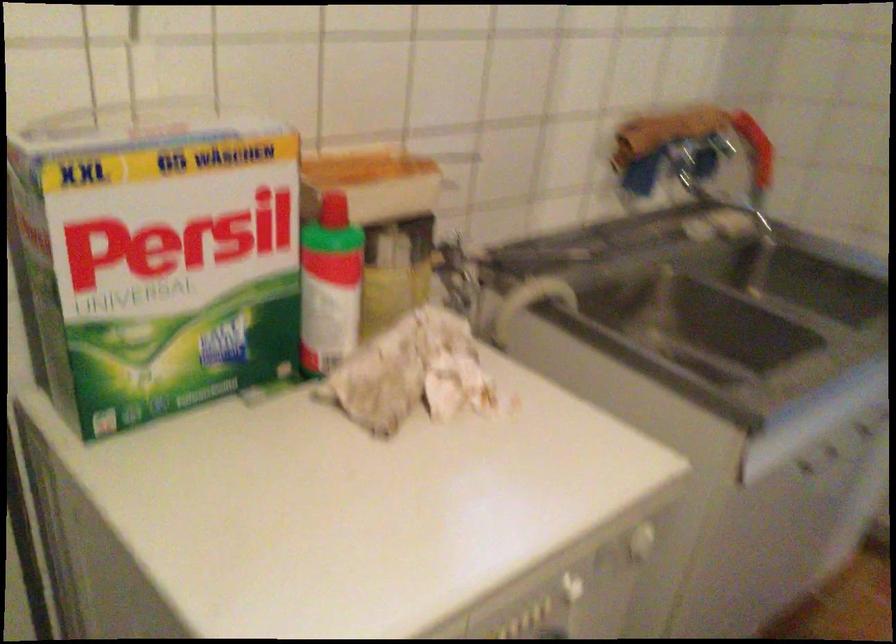
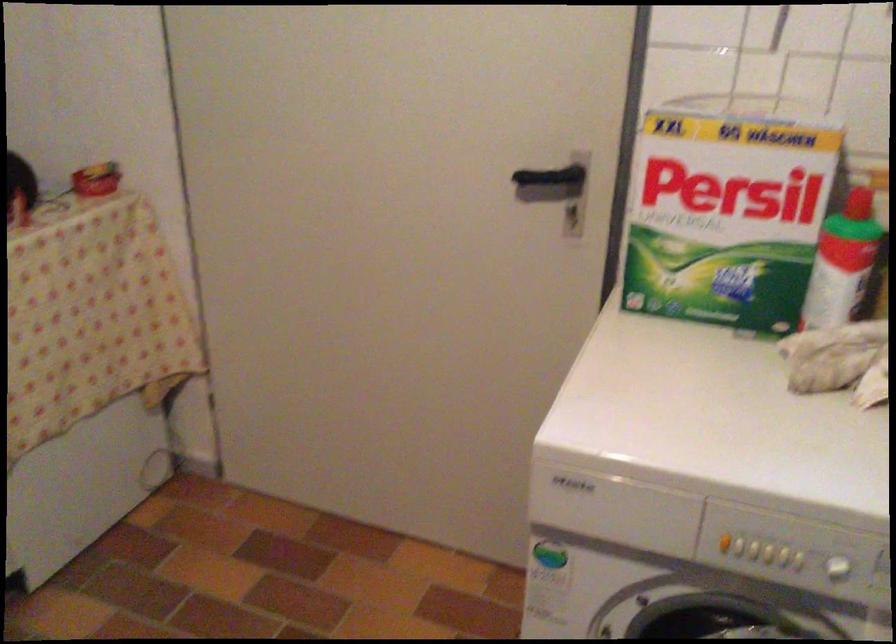
Find the pixel in the second image that matches (202,263) in the first image.

(728, 210)